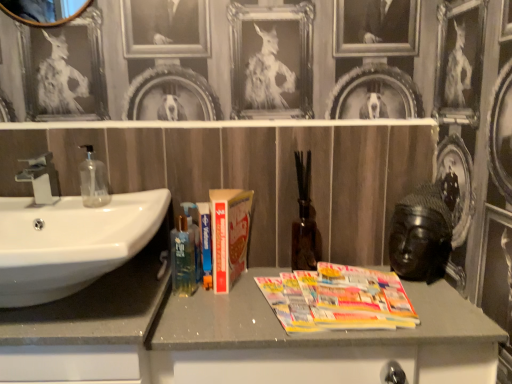
Question: From their relative heights in the image, would you say translucent plastic mouthwash at lower left is taller or shorter than matte silver faucet at left?

Choices:
 (A) tall
 (B) short

Answer: (A)

Question: Is translucent plastic mouthwash at lower left wider or thinner than matte silver faucet at left?

Choices:
 (A) thin
 (B) wide

Answer: (B)

Question: Which of these objects is positioned closest to the white glossy sink at left?

Choices:
 (A) matte gray cabinet at center
 (B) matte silver faucet at left
 (C) wooden mirror at upper left
 (D) translucent plastic mouthwash at lower left
 (E) hardcover book at center

Answer: (B)

Question: Estimate the real-world distances between objects in this image. Which object is closer to the hardcover book at center?

Choices:
 (A) translucent plastic mouthwash at lower left
 (B) wooden mirror at upper left
 (C) matte silver faucet at left
 (D) transparent glass soap dispenser at left
 (E) multicolored glossy magazines at center

Answer: (A)